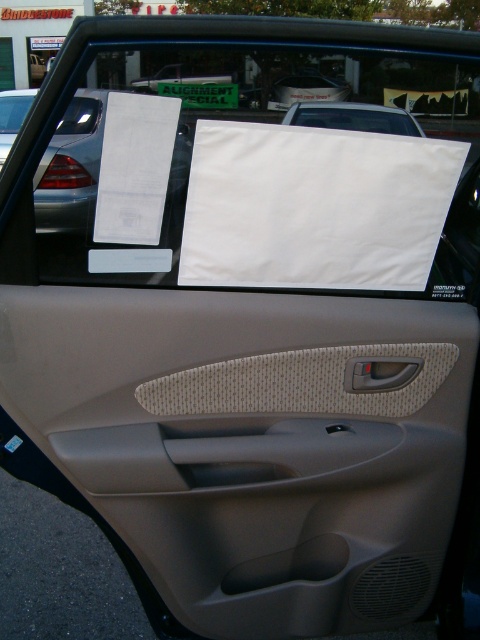
Between point (384, 372) and point (12, 76), which one is positioned in front?

Point (384, 372) is more forward.

Does beige textured door handle at center have a smaller size compared to beige fabric door at center?

Yes.

The image size is (480, 640). What are the coordinates of `beige textured door handle at center` in the screenshot? It's located at (380, 372).

I want to click on beige textured door handle at center, so click(380, 372).